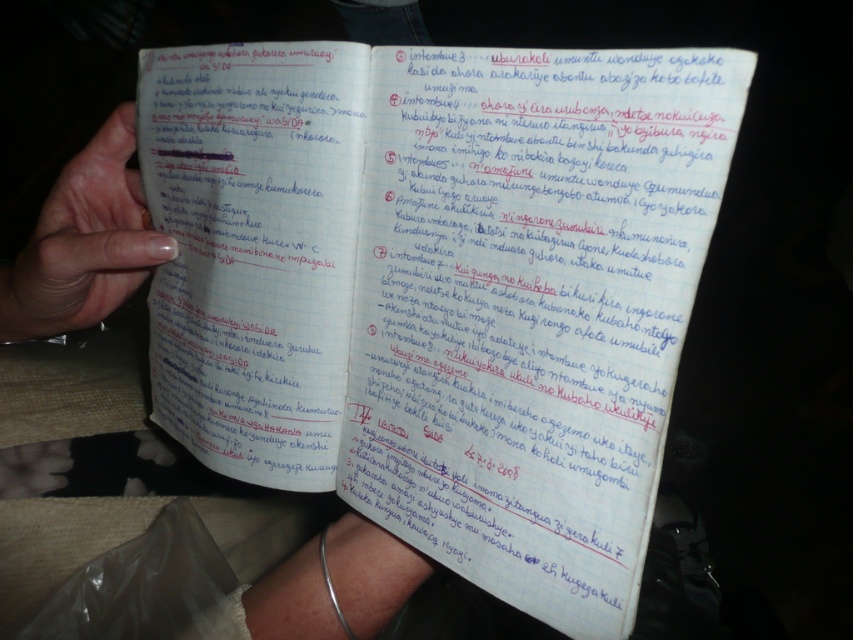
Question: Is the position of white lined paper at center more distant than that of nail polish at left?

Choices:
 (A) yes
 (B) no

Answer: (B)

Question: Is white lined paper at center below nail polish at left?

Choices:
 (A) yes
 (B) no

Answer: (A)

Question: Which point appears farthest from the camera in this image?

Choices:
 (A) (120, 253)
 (B) (218, 440)

Answer: (B)

Question: Is white lined paper at center smaller than nail polish at left?

Choices:
 (A) no
 (B) yes

Answer: (A)

Question: Which of the following is the closest to the observer?

Choices:
 (A) (134, 193)
 (B) (409, 381)

Answer: (B)